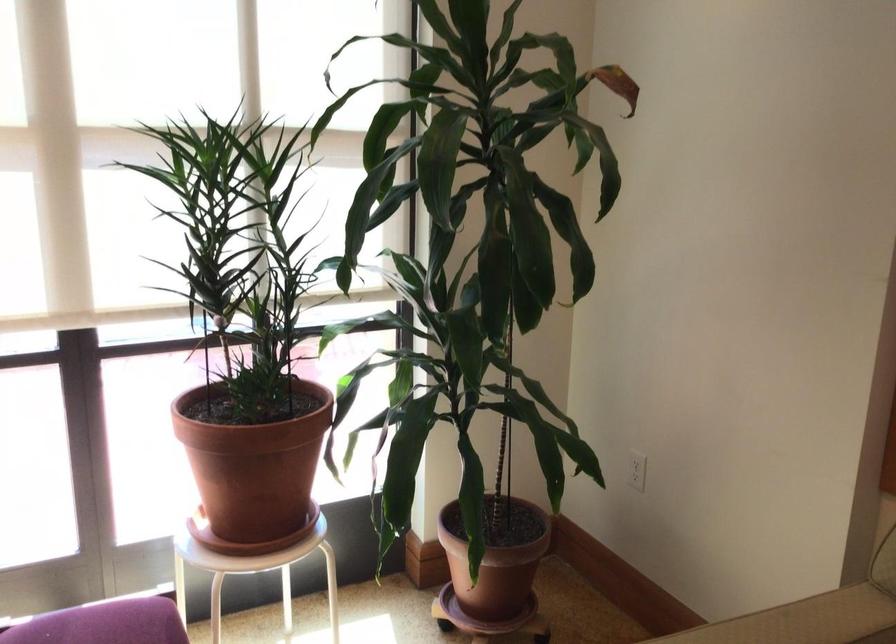
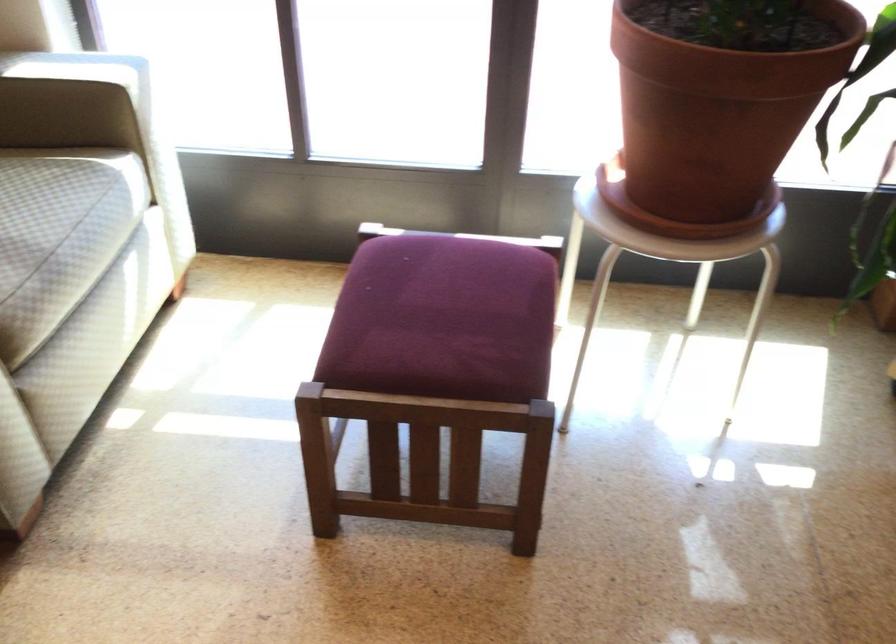
Where in the second image is the point corresponding to pixel 263 456 from the first image?

(719, 98)